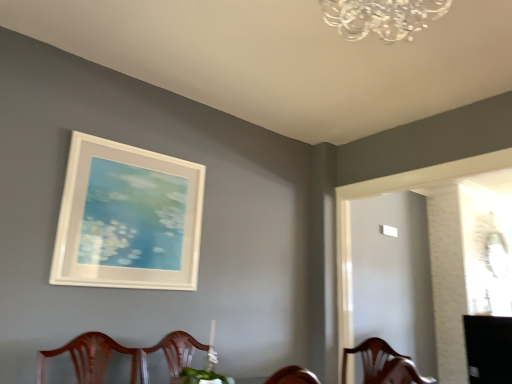
Question: Is white matte picture frame at upper center bigger than black glossy table at lower right?

Choices:
 (A) no
 (B) yes

Answer: (A)

Question: Can you confirm if white matte picture frame at upper center is shorter than black glossy table at lower right?

Choices:
 (A) no
 (B) yes

Answer: (A)

Question: Considering the relative sizes of white matte picture frame at upper center and black glossy table at lower right in the image provided, is white matte picture frame at upper center thinner than black glossy table at lower right?

Choices:
 (A) yes
 (B) no

Answer: (A)

Question: Is black glossy table at lower right surrounded by white matte picture frame at upper center?

Choices:
 (A) yes
 (B) no

Answer: (B)

Question: Considering the relative sizes of white matte picture frame at upper center and black glossy table at lower right in the image provided, is white matte picture frame at upper center taller than black glossy table at lower right?

Choices:
 (A) no
 (B) yes

Answer: (B)

Question: Is white matte picture frame at upper center next to black glossy table at lower right?

Choices:
 (A) no
 (B) yes

Answer: (A)

Question: From the image's perspective, is black glossy table at lower right under white matte picture frame at upper center?

Choices:
 (A) no
 (B) yes

Answer: (B)

Question: Is the depth of black glossy table at lower right greater than that of white matte picture frame at upper center?

Choices:
 (A) no
 (B) yes

Answer: (B)

Question: Is black glossy table at lower right bigger than white matte picture frame at upper center?

Choices:
 (A) no
 (B) yes

Answer: (B)

Question: Is black glossy table at lower right at the right side of white matte picture frame at upper center?

Choices:
 (A) yes
 (B) no

Answer: (A)

Question: From a real-world perspective, is black glossy table at lower right located higher than white matte picture frame at upper center?

Choices:
 (A) no
 (B) yes

Answer: (A)

Question: Considering the relative positions of black glossy table at lower right and white matte picture frame at upper center in the image provided, is black glossy table at lower right to the left of white matte picture frame at upper center from the viewer's perspective?

Choices:
 (A) no
 (B) yes

Answer: (A)

Question: From the image's perspective, relative to white matte picture frame at upper center, is black glossy table at lower right above or below?

Choices:
 (A) below
 (B) above

Answer: (A)